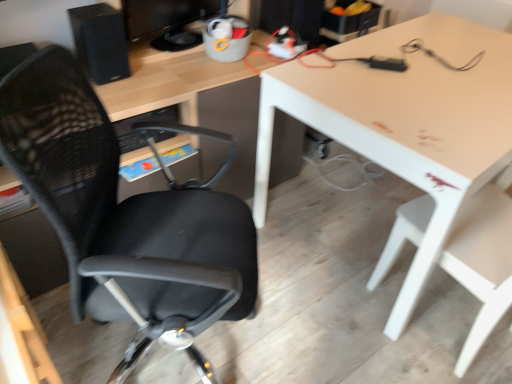
I want to click on vacant space in white glossy table at upper right (from a real-world perspective), so click(x=358, y=209).